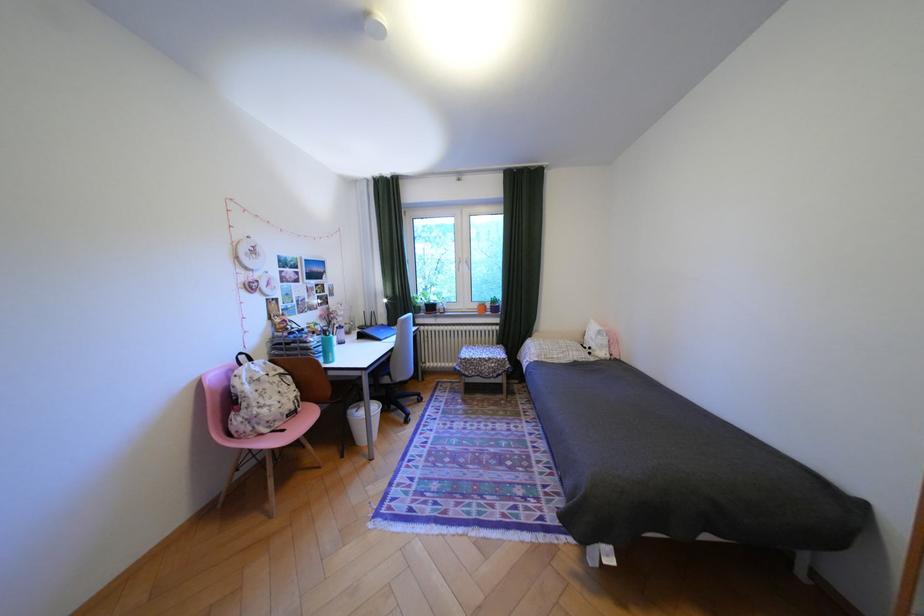
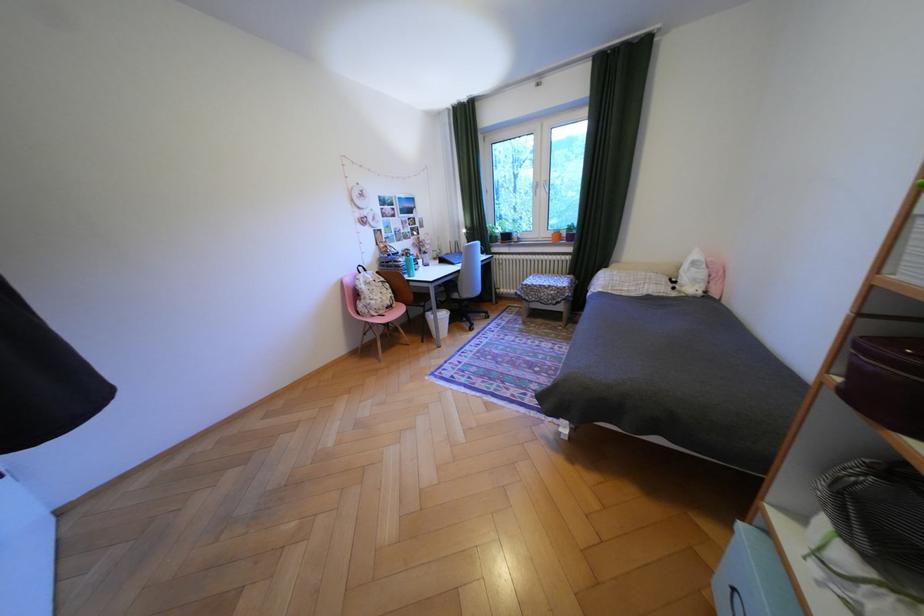
Locate, in the second image, the point that corresponds to point 289,424 in the first image.

(393, 312)